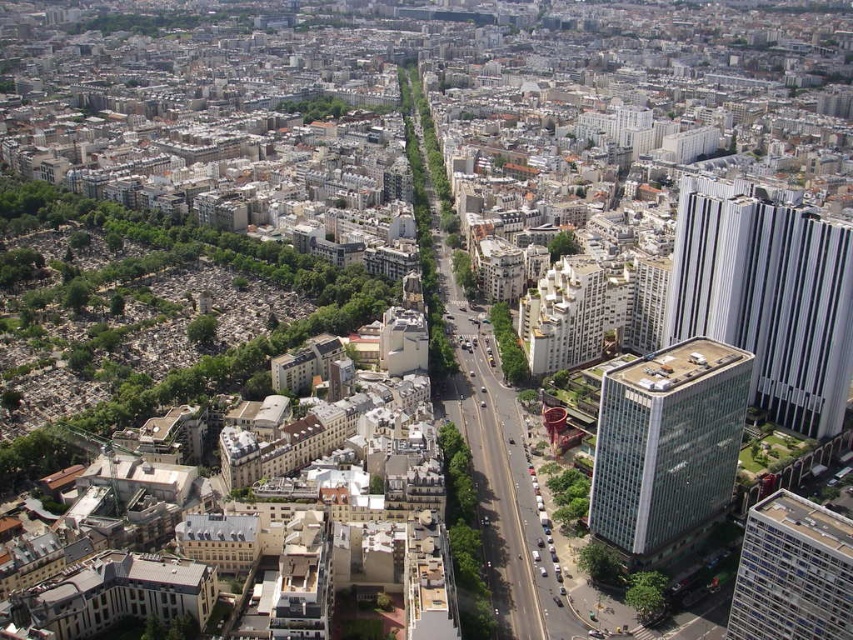
Can you confirm if white glass skyscraper at upper right is taller than white glass building at center-right?

Correct, white glass skyscraper at upper right is much taller as white glass building at center-right.

You are a GUI agent. You are given a task and a screenshot of the screen. Output one action in this format:
    pyautogui.click(x=<x>, y=<y>)
    Task: Click on the white glass skyscraper at upper right
    The image size is (853, 640).
    Given the screenshot: What is the action you would take?
    (x=767, y=296)

Can you confirm if transparent glass building at center-right is shorter than white glass building at center-right?

No.

Is point (664, 444) in front of point (759, 632)?

No, it is behind (759, 632).

The height and width of the screenshot is (640, 853). Identify the location of transparent glass building at center-right. (666, 445).

Can you confirm if white glass skyscraper at upper right is smaller than transparent glass building at center-right?

No, white glass skyscraper at upper right is not smaller than transparent glass building at center-right.

Is white glass skyscraper at upper right below transparent glass building at center-right?

Incorrect, white glass skyscraper at upper right is not positioned below transparent glass building at center-right.

Is point (798, 291) more distant than point (703, 429)?

Yes, it is behind point (703, 429).

Identify the location of white glass skyscraper at upper right. (767, 296).